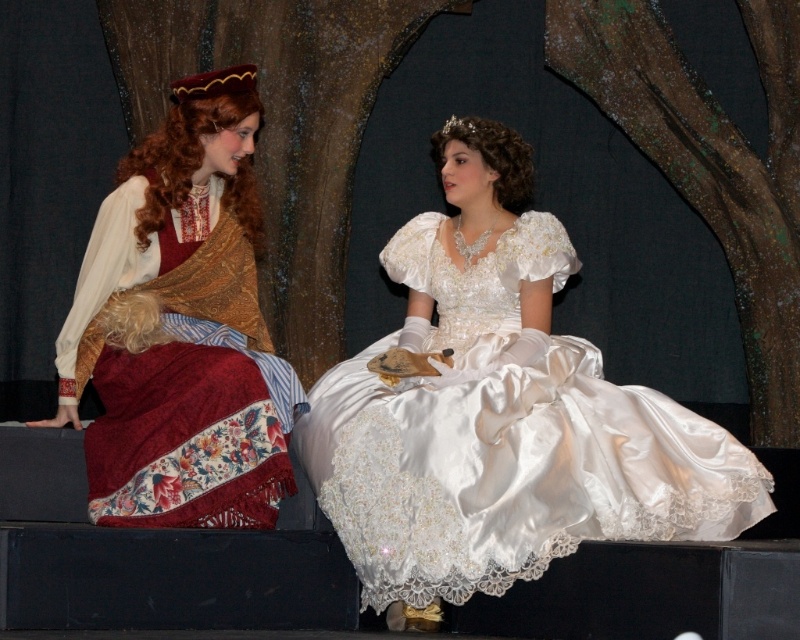
Between point (397, 467) and point (92, 490), which one is positioned behind?

Positioned behind is point (92, 490).

Is satin/embroidered dress at center further to the viewer compared to matte gold shawl at left?

No, satin/embroidered dress at center is in front of matte gold shawl at left.

Who is more distant from viewer, (388, 250) or (200, 220)?

Point (200, 220)

Where is `satin/embroidered dress at center`? satin/embroidered dress at center is located at coordinates (506, 440).